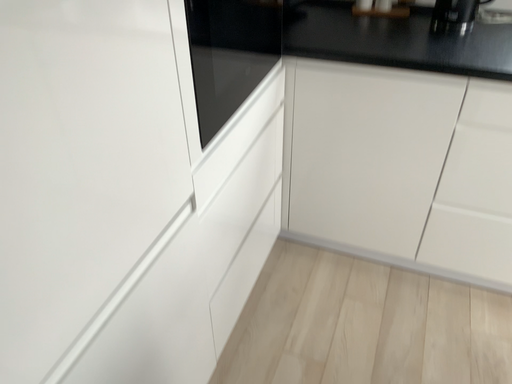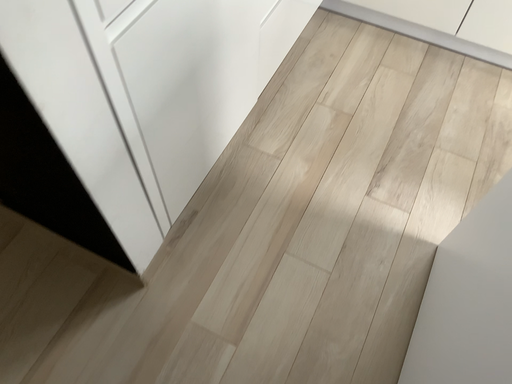
Question: How did the camera likely rotate when shooting the video?

Choices:
 (A) rotated downward
 (B) rotated upward

Answer: (A)